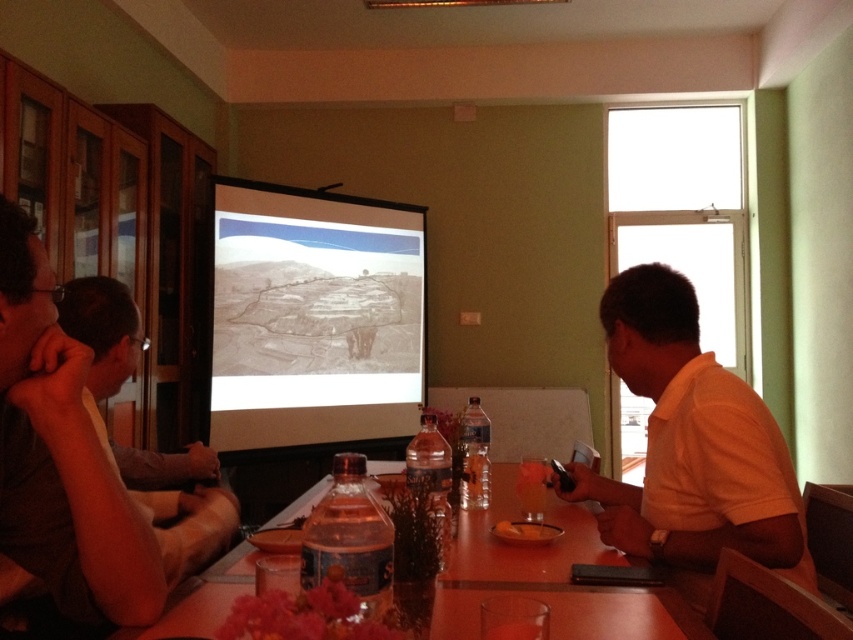
You are attending a presentation in the conference room and notice two items of the same color. The matte gray projector screen at center and the matte gray shirt at left. Which one is larger in size?

The matte gray projector screen at center is bigger than the matte gray shirt at left.

You are sitting at the table and want to see the presentation on the matte gray projector screen at center. However, the yellow matte bowl at center is blocking your view. Can you move the bowl to the side to get a clear view of the screen?

The matte gray projector screen at center is further to the viewer than the yellow matte bowl at center, so moving the yellow matte bowl at center to the side would allow you to see the screen clearly.